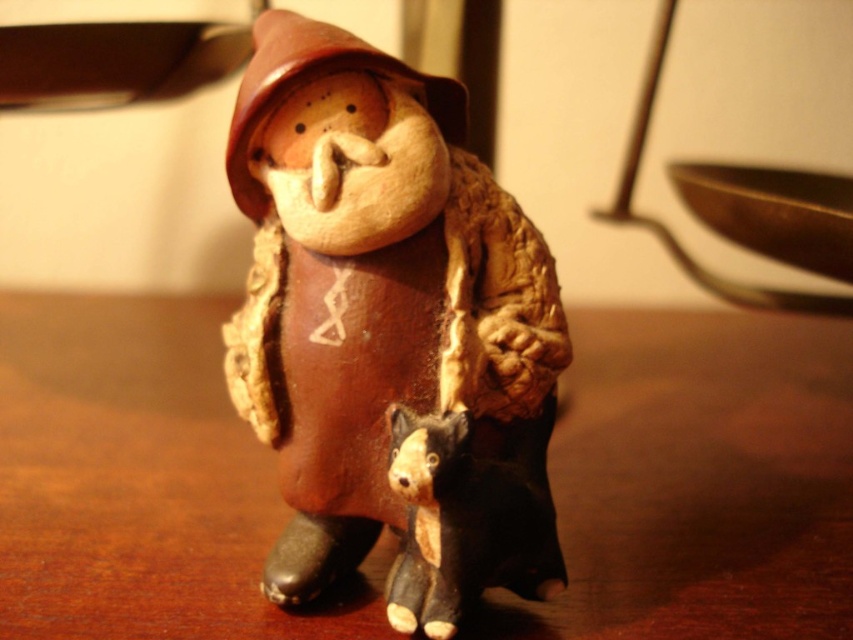
You are a 3D model designer working on a digital version of the ceramic figurine of Paddington Bear. You need to determine which point is closer to the viewer between point [195,554] and point [505,586]. Can you identify the closer point?

Point [195,554] is closer to the viewer than point [505,586].

In the scene shown: You are organizing a small display and need to place both the brown wooden table at center and the matte black dog at lower center on a shelf. Given their sizes, which object should you place first to ensure they both fit?

The brown wooden table at center is larger in size than the matte black dog at lower center, so you should place the brown wooden table at center first to ensure there is enough space for both objects.